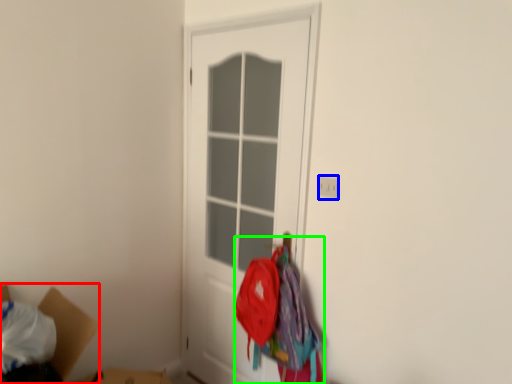
Question: Estimate the real-world distances between objects in this image. Which object is closer to cardboard box (highlighted by a red box), electric outlet (highlighted by a blue box) or laundry (highlighted by a green box)?

Choices:
 (A) electric outlet
 (B) laundry

Answer: (B)